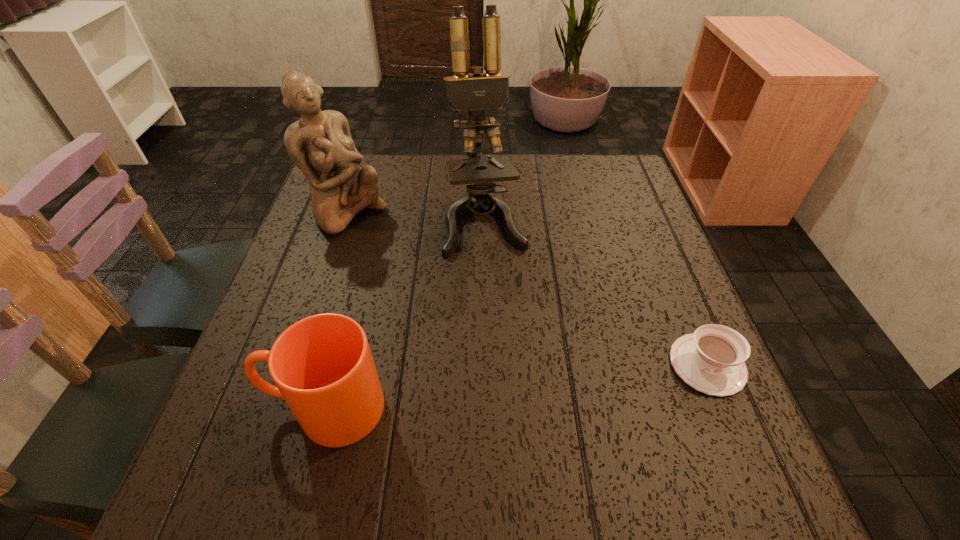
This screenshot has width=960, height=540. What are the coordinates of `vacant space on the desktop that is between the third tallest object and the rightmost object and is positioned on the front-facing side of the figurine` in the screenshot? It's located at (567, 381).

Find the location of a particular element. free spot on the desktop that is between the third tallest object and the teacup and is positioned at the eyepieces of the third object from left to right is located at coordinates (524, 386).